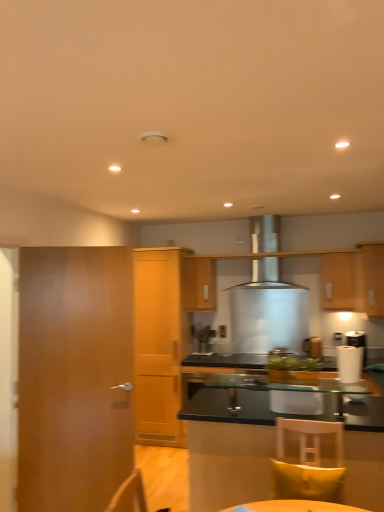
Question: From a real-world perspective, relative to satin silver range hood at center, is wooden cabinet at center, placed as the 1th cabinetry when sorted from back to front, vertically above or below?

Choices:
 (A) below
 (B) above

Answer: (A)

Question: Considering the positions of point (190, 300) and point (253, 237), is point (190, 300) closer or farther from the camera than point (253, 237)?

Choices:
 (A) closer
 (B) farther

Answer: (B)

Question: Estimate the real-world distances between objects in this image. Which object is farther from the transparent glass cabinet at lower right, arranged as the 1th cabinetry when viewed from the front?

Choices:
 (A) light wood cabinet at center, the 2th cabinetry positioned from the back
 (B) wooden cabinet at upper right, the 3th cabinetry positioned from the front
 (C) satin silver coffee machine at center
 (D) wooden cabinet at right, the second cabinetry in the front-to-back sequence
 (E) wooden door at left

Answer: (D)

Question: Estimate the real-world distances between objects in this image. Which object is farther from the wooden cabinet at center, marked as the fifth cabinetry in a front-to-back arrangement?

Choices:
 (A) light wood cabinet at center, the 2th cabinetry positioned from the back
 (B) yellow fabric pillow at lower right
 (C) wooden door at left
 (D) wooden cabinet at right, the 4th cabinetry viewed from the back
 (E) satin silver range hood at center

Answer: (B)